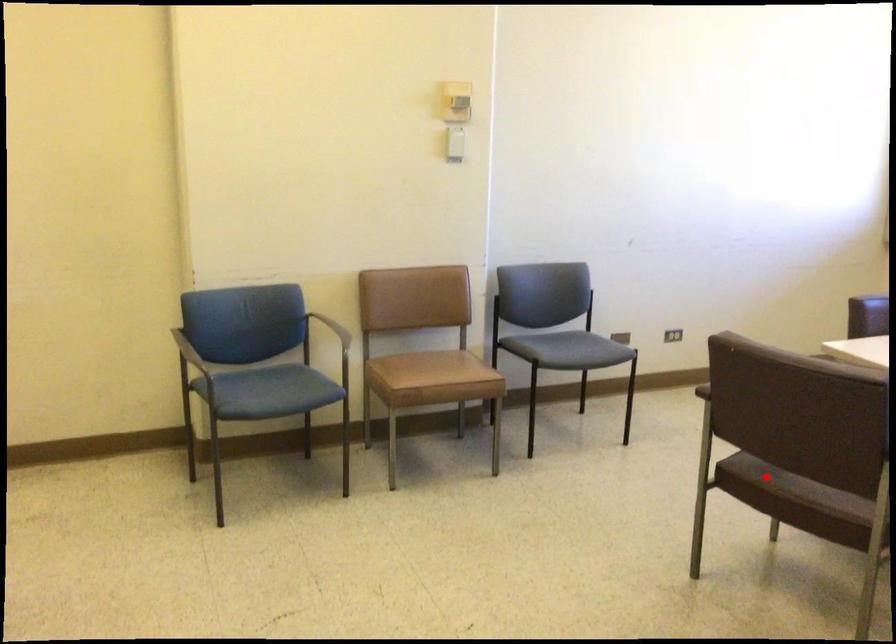
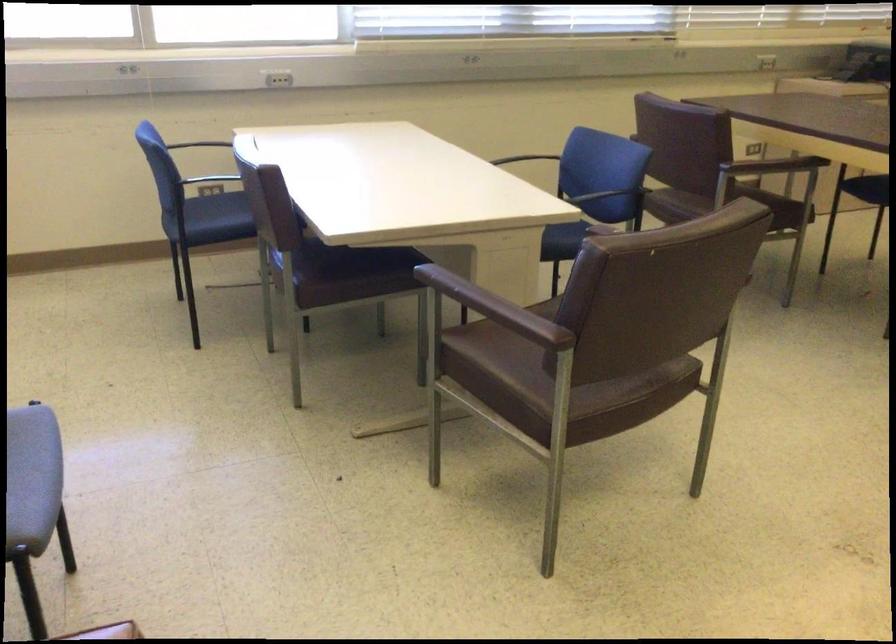
Question: I am providing you with two images of the same scene from different viewpoints. A red point is marked on the first image. Is the red point's position out of view in image 2?

Choices:
 (A) Yes
 (B) No

Answer: (B)